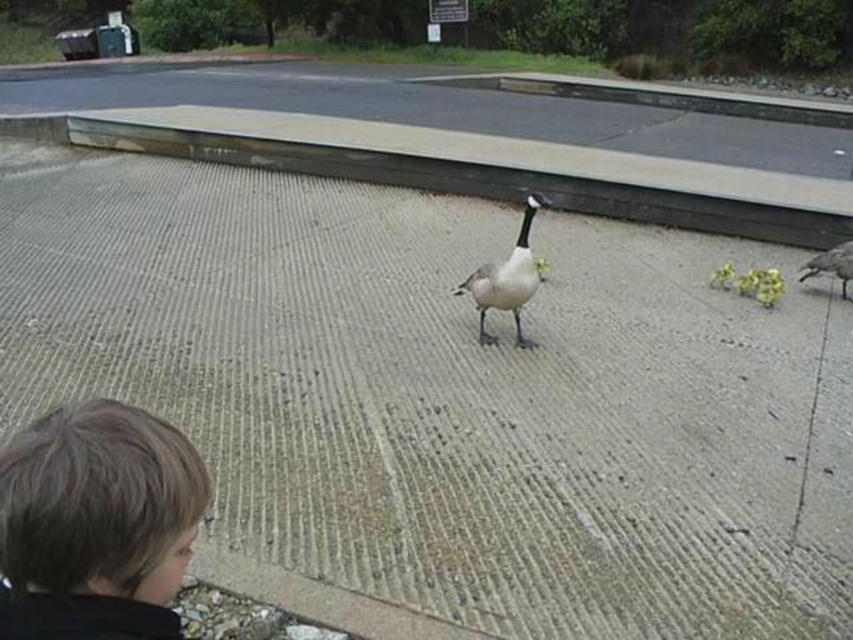
Is brown hair at lower left bigger than gray matte goose at right?

No, brown hair at lower left is not bigger than gray matte goose at right.

Is brown hair at lower left wider than gray matte goose at right?

No, brown hair at lower left is not wider than gray matte goose at right.

Does point (15, 620) come in front of point (840, 289)?

Yes, point (15, 620) is closer to viewer.

The height and width of the screenshot is (640, 853). Identify the location of brown hair at lower left. (96, 524).

Does gray concrete curb at center appear over gray matte goose at right?

Yes.

Find the location of a particular element. The image size is (853, 640). gray concrete curb at center is located at coordinates (489, 170).

Is point (163, 573) closer to camera compared to point (491, 342)?

Yes, it is.

Who is shorter, brown hair at lower left or white matte duck at center?

brown hair at lower left is shorter.

Locate an element on the screen. The width and height of the screenshot is (853, 640). brown hair at lower left is located at coordinates (96, 524).

This screenshot has width=853, height=640. What are the coordinates of `brown hair at lower left` in the screenshot? It's located at (96, 524).